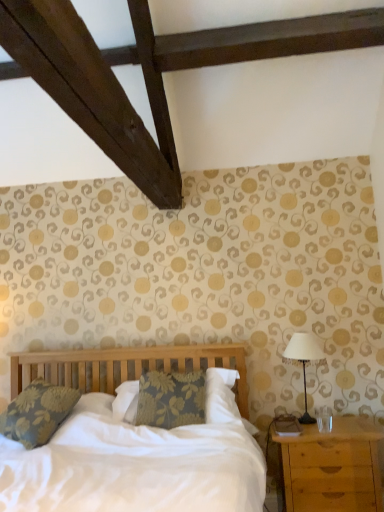
Question: Considering the positions of floral fabric pillow at left and light brown wooden nightstand at lower right in the image, is floral fabric pillow at left taller or shorter than light brown wooden nightstand at lower right?

Choices:
 (A) tall
 (B) short

Answer: (B)

Question: Relative to light brown wooden nightstand at lower right, is floral fabric pillow at left in front or behind?

Choices:
 (A) front
 (B) behind

Answer: (B)

Question: Considering the real-world distances, which object is closest to the floral fabric pillow at left?

Choices:
 (A) metallic silver table lamp at right
 (B) light brown wooden nightstand at lower right

Answer: (B)

Question: Which is farther from the light brown wooden nightstand at lower right?

Choices:
 (A) floral fabric pillow at left
 (B) metallic silver table lamp at right

Answer: (A)